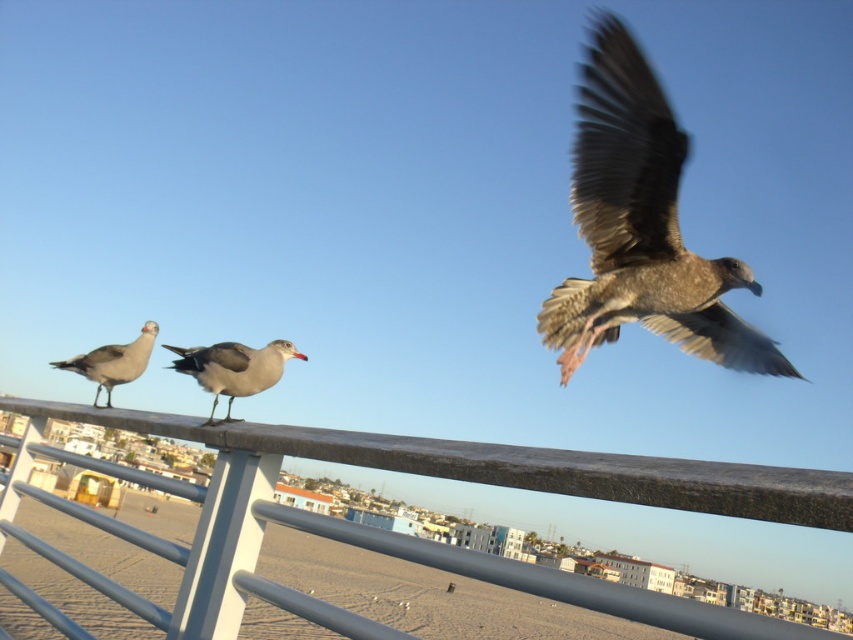
Question: Estimate the real-world distances between objects in this image. Which object is closer to the gray matte seagull at left?

Choices:
 (A) brown feathered bird at upper right
 (B) gray matte seagull at center

Answer: (B)

Question: Which point is closer to the camera taking this photo?

Choices:
 (A) (115, 344)
 (B) (339, 531)
 (C) (259, 371)
 (D) (643, 138)

Answer: (B)

Question: Is brown feathered bird at upper right bigger than gray matte seagull at left?

Choices:
 (A) no
 (B) yes

Answer: (B)

Question: Which object is positioned farthest from the gray matte seagull at center?

Choices:
 (A) gray matte seagull at left
 (B) brown feathered bird at upper right

Answer: (B)

Question: Can you confirm if metallic gray fence at upper center is positioned above gray matte seagull at center?

Choices:
 (A) no
 (B) yes

Answer: (A)

Question: Where is gray matte seagull at center located in relation to gray matte seagull at left in the image?

Choices:
 (A) below
 (B) above

Answer: (B)